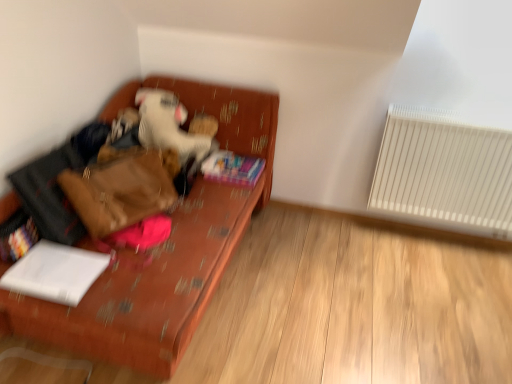
I want to click on vacant area to the right of textured orange couch at left, so click(347, 288).